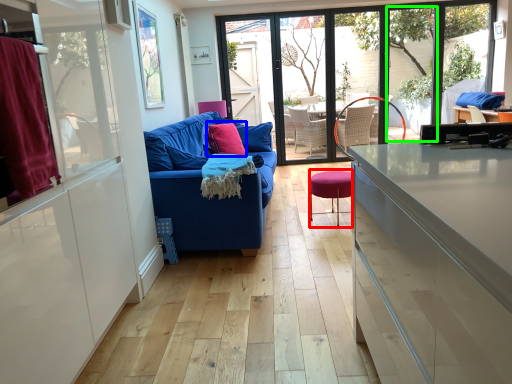
Question: Which is nearer to the bar stool (highlighted by a red box)? pillow (highlighted by a blue box) or window (highlighted by a green box).

Choices:
 (A) pillow
 (B) window

Answer: (A)